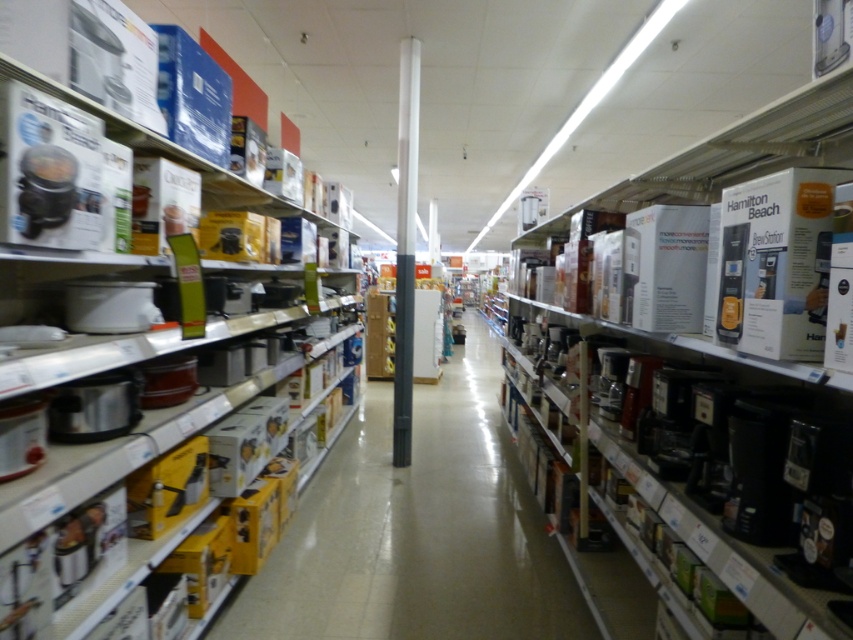
Question: Can you confirm if matte black coffee maker at center is positioned above matte white crockpot at upper left?

Choices:
 (A) yes
 (B) no

Answer: (B)

Question: Can you confirm if matte black coffee maker at center is smaller than matte white crockpot at upper left?

Choices:
 (A) no
 (B) yes

Answer: (A)

Question: Can you confirm if matte black coffee maker at center is positioned below matte white crockpot at upper left?

Choices:
 (A) yes
 (B) no

Answer: (A)

Question: Which point appears farthest from the camera in this image?

Choices:
 (A) (59, 356)
 (B) (312, 488)

Answer: (B)